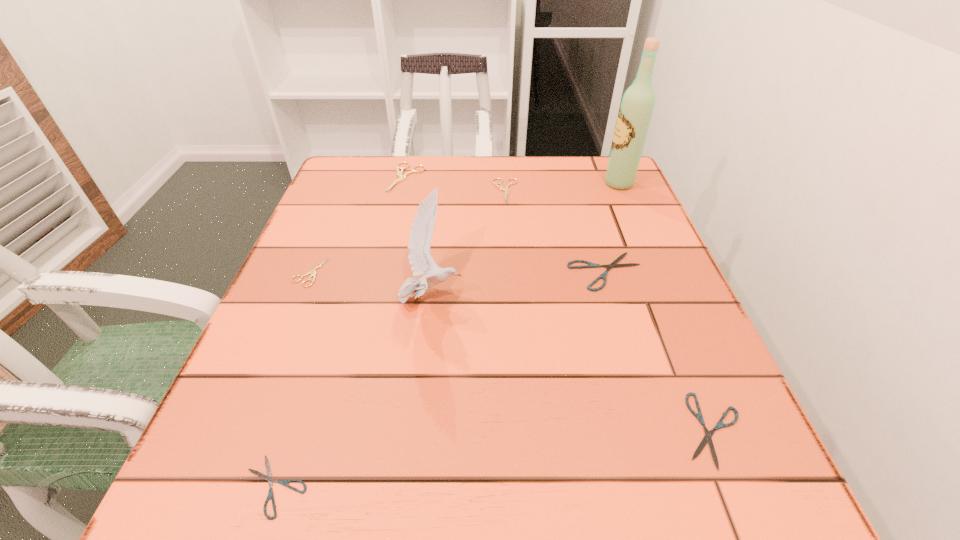
Locate an element on the screen. The width and height of the screenshot is (960, 540). blank area located 0.310m on the front of the biggest black shears is located at coordinates (660, 449).

Locate an element on the screen. free spot located 0.050m on the right of the leftmost beige shears is located at coordinates (350, 272).

You are a GUI agent. You are given a task and a screenshot of the screen. Output one action in this format:
    pyautogui.click(x=<x>, y=<y>)
    Task: Click on the free space located on the left of the second smallest black shears
    This screenshot has height=540, width=960.
    Given the screenshot: What is the action you would take?
    pyautogui.click(x=638, y=430)

Where is `free location located on the back of the shortest shears`? The width and height of the screenshot is (960, 540). free location located on the back of the shortest shears is located at coordinates (318, 355).

The height and width of the screenshot is (540, 960). Identify the location of wine bottle present at the far edge. (637, 106).

Image resolution: width=960 pixels, height=540 pixels. In order to click on wine bottle that is at the right edge in this screenshot , I will do `click(637, 106)`.

This screenshot has width=960, height=540. Find the location of `object present at the far left corner`. object present at the far left corner is located at coordinates (399, 173).

The width and height of the screenshot is (960, 540). Find the location of `object situated at the near left corner`. object situated at the near left corner is located at coordinates tap(268, 477).

Locate an element on the screen. The width and height of the screenshot is (960, 540). object at the far right corner is located at coordinates pyautogui.click(x=637, y=106).

At what (x,y) coordinates should I click in order to perform the action: click on object that is positioned at the near right corner. Please return your answer as a coordinate pair (x, y). Looking at the image, I should click on (707, 438).